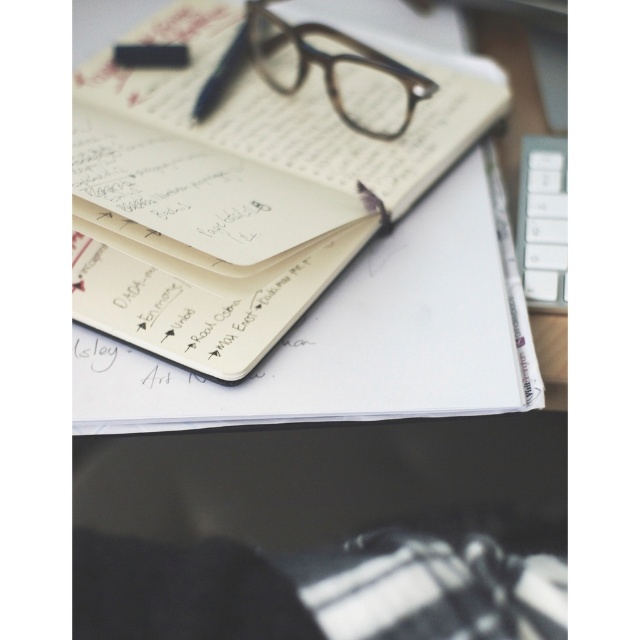
Question: Is matte paper notebook at center bigger than white plastic keyboard at upper right?

Choices:
 (A) yes
 (B) no

Answer: (A)

Question: Estimate the real-world distances between objects in this image. Which object is farther from the white plastic keyboard at upper right?

Choices:
 (A) brown tortoiseshell glasses at upper center
 (B) matte paper notebook at center

Answer: (B)

Question: Is brown tortoiseshell glasses at upper center in front of white plastic keyboard at upper right?

Choices:
 (A) yes
 (B) no

Answer: (B)

Question: Can you confirm if matte paper notebook at center is positioned above brown tortoiseshell glasses at upper center?

Choices:
 (A) no
 (B) yes

Answer: (A)

Question: Which point appears closest to the camera in this image?

Choices:
 (A) (333, 92)
 (B) (188, 33)
 (C) (563, 180)

Answer: (C)

Question: Which object appears closest to the camera in this image?

Choices:
 (A) brown tortoiseshell glasses at upper center
 (B) matte paper notebook at center
 (C) white plastic keyboard at upper right

Answer: (B)